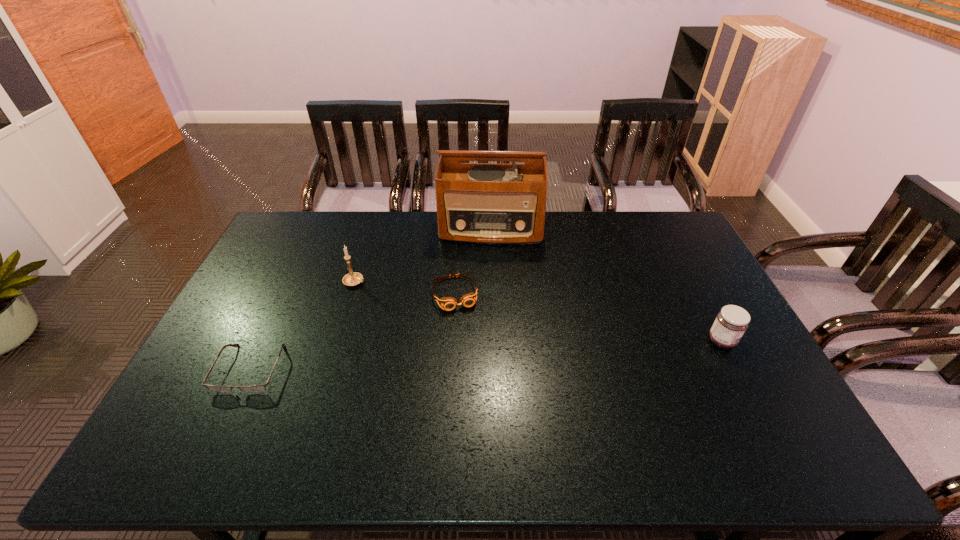
Identify the location of free spot on the desktop that is between the leftmost object and the jam and is positioned on the front panel of the farthest object. (485, 355).

This screenshot has width=960, height=540. I want to click on free spot on the desktop that is between the shortest object and the third tallest object and is positioned on the handle side of the fourth shortest object, so click(x=528, y=352).

This screenshot has width=960, height=540. What are the coordinates of `vacant spot on the desktop that is between the leftmost object and the jam and is positioned with the lenses facing forward on the goggles` in the screenshot? It's located at (473, 355).